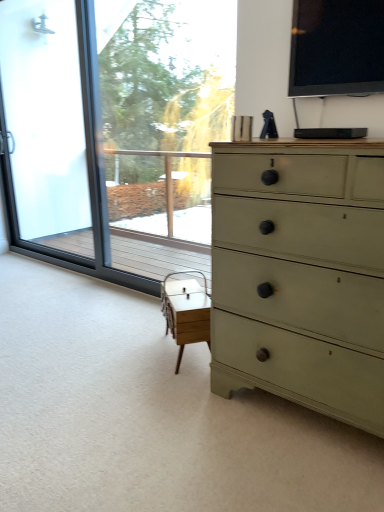
Question: Is transparent glass window at left, the second window screen viewed from the front, shorter than frosted glass screen door at left?

Choices:
 (A) no
 (B) yes

Answer: (B)

Question: From the image's perspective, is transparent glass window at left, the second window screen viewed from the front, on frosted glass screen door at left?

Choices:
 (A) no
 (B) yes

Answer: (A)

Question: Can you confirm if transparent glass window at left, the second window screen viewed from the front, is smaller than frosted glass screen door at left?

Choices:
 (A) no
 (B) yes

Answer: (A)

Question: Is transparent glass window at left, the 1th window screen from the back, next to frosted glass screen door at left?

Choices:
 (A) yes
 (B) no

Answer: (B)

Question: Is transparent glass window at left, the 1th window screen from the back, wider than frosted glass screen door at left?

Choices:
 (A) no
 (B) yes

Answer: (B)

Question: Considering the relative positions of transparent glass window at left, which appears as the 1th window screen when viewed from the left, and frosted glass screen door at left in the image provided, is transparent glass window at left, which appears as the 1th window screen when viewed from the left, to the left of frosted glass screen door at left from the viewer's perspective?

Choices:
 (A) no
 (B) yes

Answer: (A)

Question: Does transparent glass window at left, which appears as the 1th window screen when viewed from the left, appear on the left side of matte green dresser at right?

Choices:
 (A) yes
 (B) no

Answer: (A)

Question: Can you confirm if transparent glass window at left, which is the 2th window screen in right-to-left order, is wider than matte green dresser at right?

Choices:
 (A) no
 (B) yes

Answer: (A)

Question: Is transparent glass window at left, which appears as the 1th window screen when viewed from the left, oriented towards matte green dresser at right?

Choices:
 (A) yes
 (B) no

Answer: (B)

Question: Can you confirm if transparent glass window at left, which is the 2th window screen in right-to-left order, is smaller than matte green dresser at right?

Choices:
 (A) yes
 (B) no

Answer: (A)

Question: Does transparent glass window at left, the 1th window screen from the back, contain matte green dresser at right?

Choices:
 (A) yes
 (B) no

Answer: (B)

Question: Does transparent glass window at left, which appears as the 1th window screen when viewed from the left, lie in front of matte green dresser at right?

Choices:
 (A) no
 (B) yes

Answer: (A)

Question: Is frosted glass screen door at left oriented away from transparent glass window at left, the 1th window screen from the back?

Choices:
 (A) no
 (B) yes

Answer: (A)